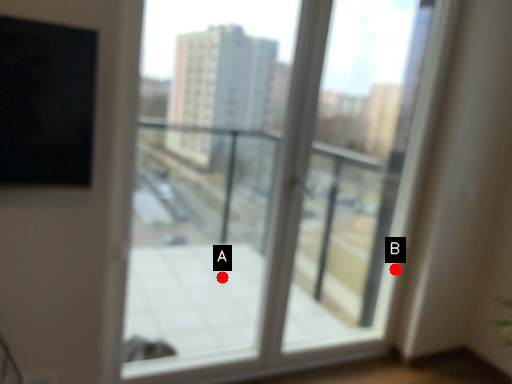
Question: Two points are circled on the image, labeled by A and B beside each circle. Among these points, which one is nearest to the camera?

Choices:
 (A) A is closer
 (B) B is closer

Answer: (B)